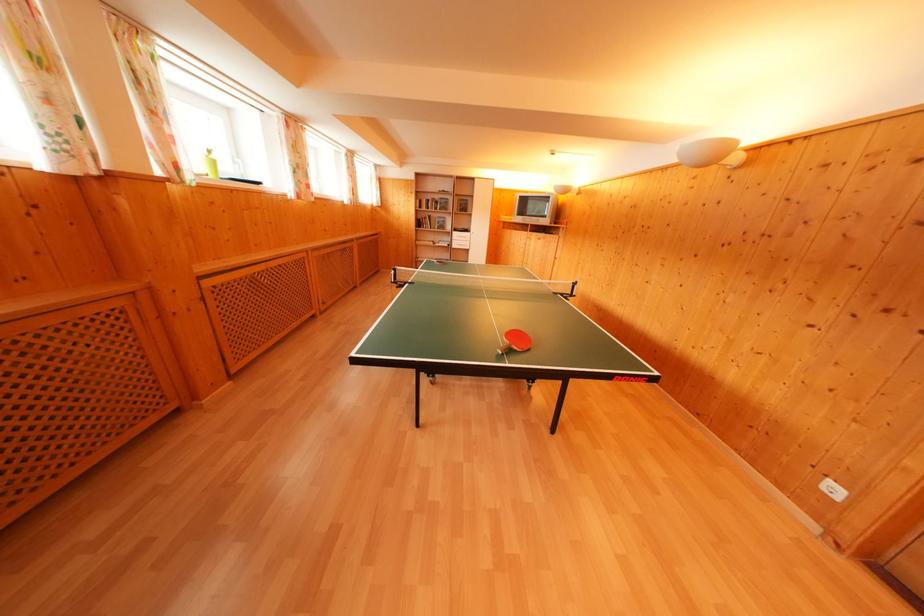
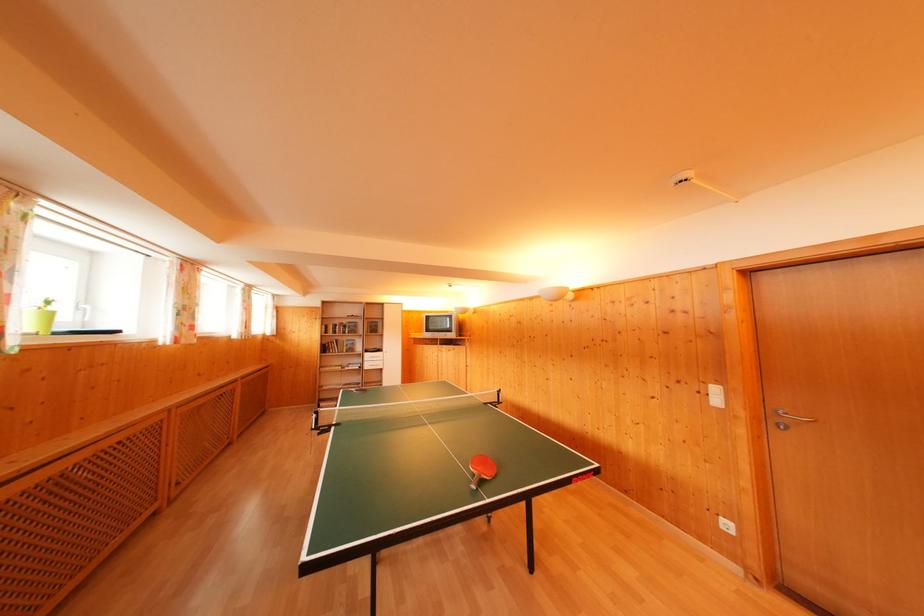
The point at (459, 238) is marked in the first image. Where is the corresponding point in the second image?

(371, 360)